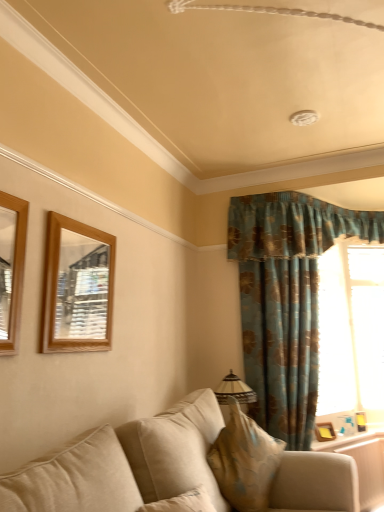
Question: From a real-world perspective, is wooden mirror at upper left, which appears as the second picture frame when viewed from the front, physically below wooden picture frame at lower right, the 3th picture frame from the front?

Choices:
 (A) no
 (B) yes

Answer: (A)

Question: From the image's perspective, is wooden mirror at upper left, positioned as the second picture frame in left-to-right order, located beneath wooden picture frame at lower right, the 3th picture frame positioned from the left?

Choices:
 (A) no
 (B) yes

Answer: (A)

Question: From the image's perspective, is wooden mirror at upper left, the 3th picture frame positioned from the right, over wooden picture frame at lower right, positioned as the 2th picture frame in bottom-to-top order?

Choices:
 (A) yes
 (B) no

Answer: (A)

Question: Can you confirm if wooden mirror at upper left, positioned as the second picture frame in left-to-right order, is thinner than wooden picture frame at lower right, arranged as the second picture frame when viewed from the right?

Choices:
 (A) no
 (B) yes

Answer: (B)

Question: Is wooden mirror at upper left, the 3th picture frame positioned from the right, wider than wooden picture frame at lower right, positioned as the 2th picture frame in bottom-to-top order?

Choices:
 (A) no
 (B) yes

Answer: (A)

Question: Visually, is wooden mirror at left, arranged as the first picture frame when viewed from the left, positioned to the left or to the right of beige fabric pillow at lower center?

Choices:
 (A) left
 (B) right

Answer: (A)

Question: Considering the positions of wooden mirror at left, the 1th picture frame from the front, and beige fabric pillow at lower center in the image, is wooden mirror at left, the 1th picture frame from the front, bigger or smaller than beige fabric pillow at lower center?

Choices:
 (A) big
 (B) small

Answer: (B)

Question: Is wooden mirror at left, which is counted as the fourth picture frame, starting from the bottom, wider or thinner than beige fabric pillow at lower center?

Choices:
 (A) thin
 (B) wide

Answer: (A)

Question: Considering the positions of wooden mirror at left, arranged as the first picture frame when viewed from the left, and beige fabric pillow at lower center in the image, is wooden mirror at left, arranged as the first picture frame when viewed from the left, taller or shorter than beige fabric pillow at lower center?

Choices:
 (A) short
 (B) tall

Answer: (B)

Question: Is wooden picture frame at lower right, the 3th picture frame positioned from the left, wider or thinner than transparent glass window at right?

Choices:
 (A) thin
 (B) wide

Answer: (A)

Question: Is wooden picture frame at lower right, arranged as the second picture frame when viewed from the right, to the left or to the right of transparent glass window at right in the image?

Choices:
 (A) right
 (B) left

Answer: (B)

Question: Is wooden picture frame at lower right, positioned as the 2th picture frame in bottom-to-top order, taller or shorter than transparent glass window at right?

Choices:
 (A) short
 (B) tall

Answer: (A)

Question: Based on their sizes in the image, would you say wooden picture frame at lower right, the 3th picture frame from the front, is bigger or smaller than transparent glass window at right?

Choices:
 (A) small
 (B) big

Answer: (A)

Question: Which is correct: wooden picture frame at right, the 1th picture frame positioned from the back, is inside wooden frame at lower right, or outside of it?

Choices:
 (A) inside
 (B) outside

Answer: (B)

Question: Relative to wooden frame at lower right, is wooden picture frame at right, the 1th picture frame positioned from the back, in front or behind?

Choices:
 (A) behind
 (B) front

Answer: (A)